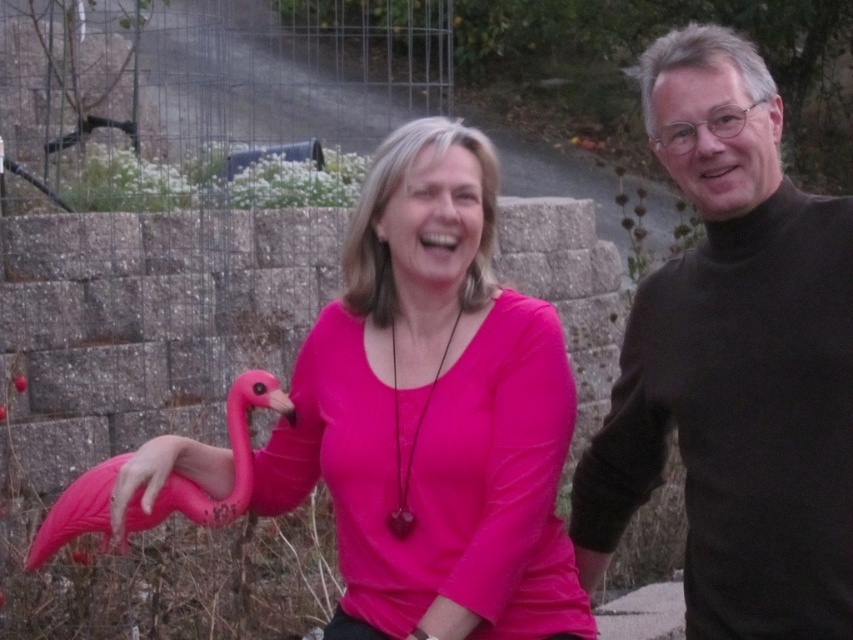
Question: Is pink matte plastic flamingo at center positioned before black turtleneck sweater at right?

Choices:
 (A) yes
 (B) no

Answer: (B)

Question: Which object is the closest to the pink plastic flamingo at lower left?

Choices:
 (A) pink matte plastic flamingo at center
 (B) black turtleneck sweater at right

Answer: (A)

Question: Does pink matte plastic flamingo at center have a greater width compared to black turtleneck sweater at right?

Choices:
 (A) no
 (B) yes

Answer: (B)

Question: Can you confirm if pink matte plastic flamingo at center is thinner than black turtleneck sweater at right?

Choices:
 (A) no
 (B) yes

Answer: (A)

Question: Which object is the closest to the pink matte plastic flamingo at center?

Choices:
 (A) black turtleneck sweater at right
 (B) pink plastic flamingo at lower left

Answer: (B)

Question: Which point is farther to the camera?

Choices:
 (A) black turtleneck sweater at right
 (B) pink plastic flamingo at lower left
 (C) pink matte plastic flamingo at center

Answer: (B)